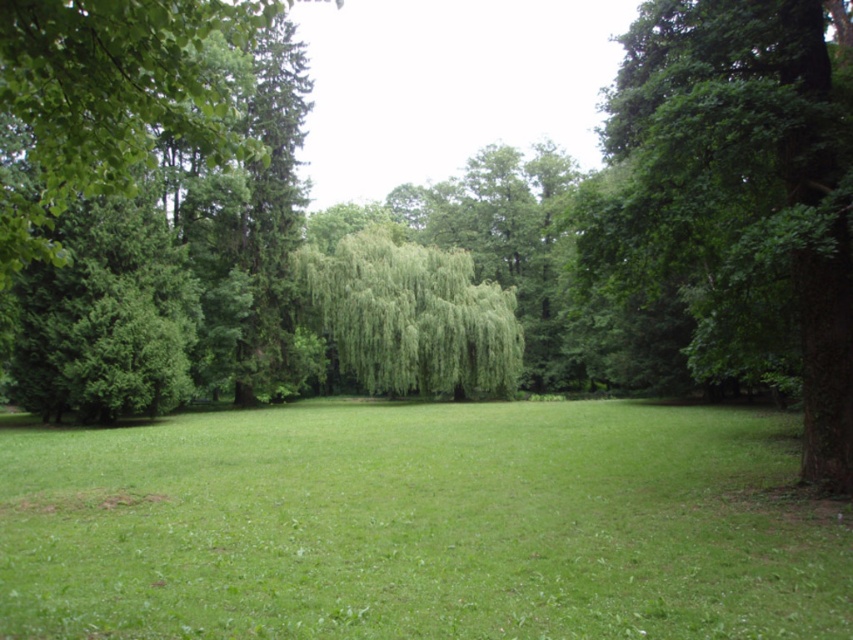
You are standing at the point labeled as point (421, 524) in the image. What is the name of the object directly beneath your feet?

The object directly beneath your feet is the green grass at center, which is located at point (421, 524).

You are standing in the middle of the green grass at center and want to walk towards the green leafy tree at right. Which direction should you head to get closer to the tree?

Since the green grass at center is closer to the viewer than the green leafy tree at right, you should head towards the right direction to get closer to the tree.

Consider the image. You are standing at the center of the grassy area and want to reach the green grass at center. Since you are already at the center, can you step onto it?

Yes, you can step onto the green grass at center because you are already standing at the center of the grassy area.